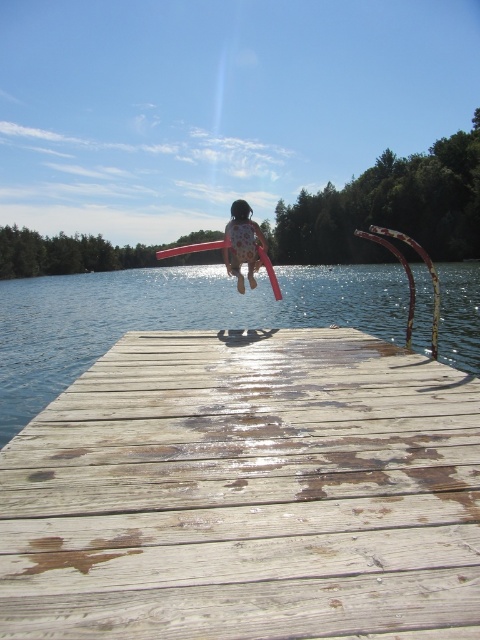
Question: Which object is the closest to the clear water at center?

Choices:
 (A) matte pink swimsuit at center
 (B) weathered wood dock at center

Answer: (A)

Question: Which point is farther from the camera taking this photo?

Choices:
 (A) (462, 596)
 (B) (444, 346)

Answer: (B)

Question: Among these objects, which one is farthest from the camera?

Choices:
 (A) matte pink swimsuit at center
 (B) weathered wood dock at center
 (C) clear water at center

Answer: (A)

Question: Can you confirm if clear water at center is smaller than matte pink swimsuit at center?

Choices:
 (A) no
 (B) yes

Answer: (A)

Question: Is weathered wood dock at center below clear water at center?

Choices:
 (A) yes
 (B) no

Answer: (A)

Question: Can you confirm if weathered wood dock at center is bigger than matte pink swimsuit at center?

Choices:
 (A) no
 (B) yes

Answer: (A)